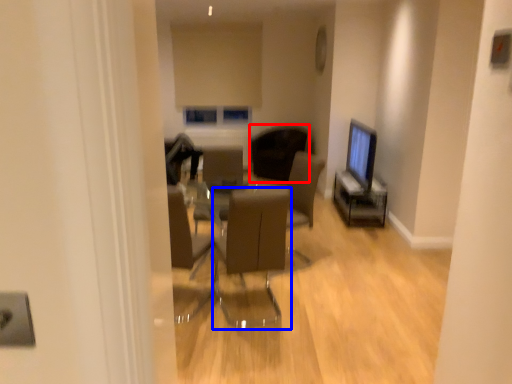
Question: Among these objects, which one is farthest to the camera, chair (highlighted by a red box) or chair (highlighted by a blue box)?

Choices:
 (A) chair
 (B) chair

Answer: (A)